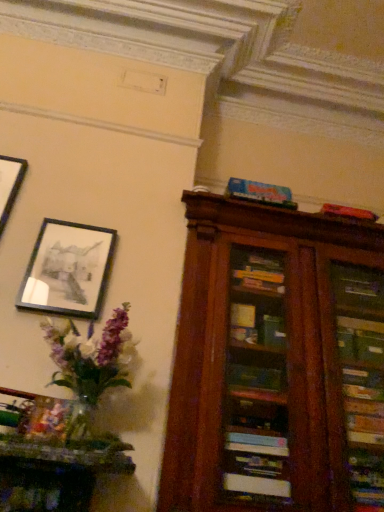
Question: Is blue matte board game at upper center further to camera compared to matte black picture frame at upper left?

Choices:
 (A) no
 (B) yes

Answer: (B)

Question: Is blue matte board game at upper center to the left of matte black picture frame at upper left from the viewer's perspective?

Choices:
 (A) yes
 (B) no

Answer: (B)

Question: Can we say blue matte board game at upper center lies outside matte black picture frame at upper left?

Choices:
 (A) yes
 (B) no

Answer: (A)

Question: Does blue matte board game at upper center have a greater width compared to matte black picture frame at upper left?

Choices:
 (A) no
 (B) yes

Answer: (B)

Question: Does blue matte board game at upper center touch matte black picture frame at upper left?

Choices:
 (A) yes
 (B) no

Answer: (B)

Question: Is blue matte board game at upper center spatially inside translucent glass vase at left, or outside of it?

Choices:
 (A) outside
 (B) inside

Answer: (A)

Question: Considering the relative positions of blue matte board game at upper center and translucent glass vase at left in the image provided, is blue matte board game at upper center to the left or to the right of translucent glass vase at left?

Choices:
 (A) left
 (B) right

Answer: (B)

Question: Is blue matte board game at upper center taller or shorter than translucent glass vase at left?

Choices:
 (A) tall
 (B) short

Answer: (B)

Question: From the image's perspective, relative to translucent glass vase at left, is blue matte board game at upper center above or below?

Choices:
 (A) below
 (B) above

Answer: (B)

Question: Is matte black picture frame at upper left wider or thinner than translucent glass vase at left?

Choices:
 (A) thin
 (B) wide

Answer: (A)

Question: Would you say matte black picture frame at upper left is to the left or to the right of translucent glass vase at left in the picture?

Choices:
 (A) left
 (B) right

Answer: (A)

Question: From the image's perspective, is matte black picture frame at upper left positioned above or below translucent glass vase at left?

Choices:
 (A) below
 (B) above

Answer: (B)

Question: Considering their positions, is matte black picture frame at upper left located in front of or behind translucent glass vase at left?

Choices:
 (A) behind
 (B) front

Answer: (A)

Question: Is translucent glass vase at left bigger or smaller than matte black picture frame at upper left?

Choices:
 (A) big
 (B) small

Answer: (A)

Question: Choose the correct answer: Is translucent glass vase at left inside matte black picture frame at upper left or outside it?

Choices:
 (A) outside
 (B) inside

Answer: (A)